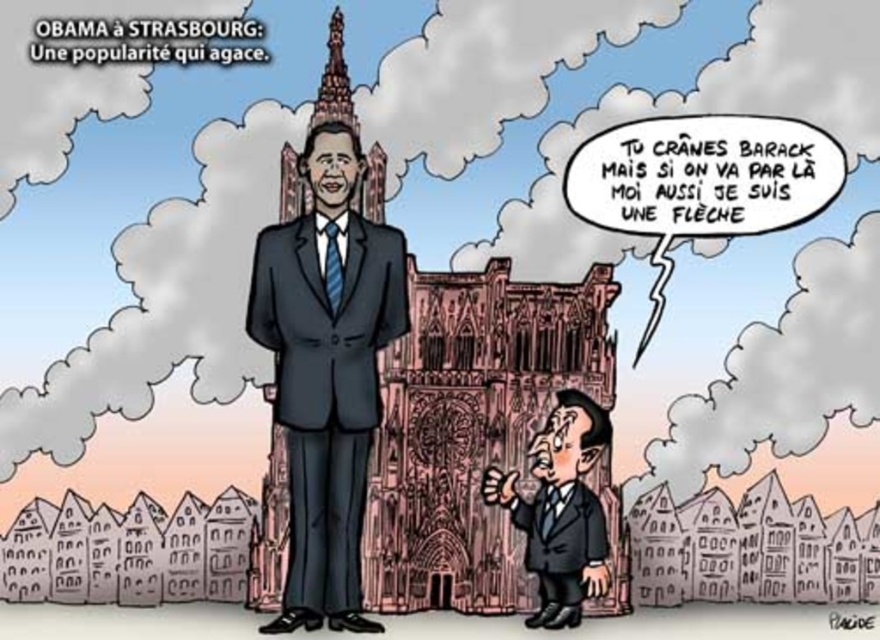
Based on the provided scene description, where exactly is the matte black suit at center located in terms of coordinates?

The matte black suit at center is located at point coordinates of (326, 371).